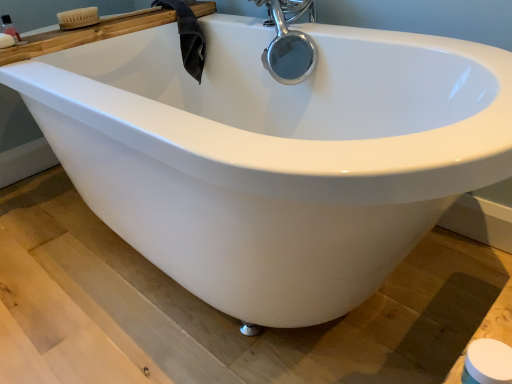
Question: Is white matte soap at upper left bigger than woodenbrush at upper left?

Choices:
 (A) no
 (B) yes

Answer: (A)

Question: Is white matte soap at upper left oriented towards woodenbrush at upper left?

Choices:
 (A) no
 (B) yes

Answer: (A)

Question: Considering the relative positions of white matte soap at upper left and woodenbrush at upper left in the image provided, is white matte soap at upper left to the right of woodenbrush at upper left from the viewer's perspective?

Choices:
 (A) no
 (B) yes

Answer: (A)

Question: Can you confirm if white matte soap at upper left is shorter than woodenbrush at upper left?

Choices:
 (A) no
 (B) yes

Answer: (B)

Question: Does white matte soap at upper left have a smaller size compared to woodenbrush at upper left?

Choices:
 (A) yes
 (B) no

Answer: (A)

Question: Is white matte soap at upper left surrounding woodenbrush at upper left?

Choices:
 (A) no
 (B) yes

Answer: (A)

Question: Does white matte toilet paper at lower right have a larger size compared to woodenbrush at upper left?

Choices:
 (A) yes
 (B) no

Answer: (B)

Question: Can you confirm if white matte toilet paper at lower right is positioned to the left of woodenbrush at upper left?

Choices:
 (A) yes
 (B) no

Answer: (B)

Question: Is white matte toilet paper at lower right further to the viewer compared to woodenbrush at upper left?

Choices:
 (A) no
 (B) yes

Answer: (A)

Question: Considering the relative sizes of white matte toilet paper at lower right and woodenbrush at upper left in the image provided, is white matte toilet paper at lower right thinner than woodenbrush at upper left?

Choices:
 (A) yes
 (B) no

Answer: (A)

Question: Does white matte toilet paper at lower right appear on the right side of woodenbrush at upper left?

Choices:
 (A) no
 (B) yes

Answer: (B)

Question: Could woodenbrush at upper left be considered to be inside white matte toilet paper at lower right?

Choices:
 (A) yes
 (B) no

Answer: (B)

Question: From the image's perspective, is translucent plastic bottle at upper left above white matte toilet paper at lower right?

Choices:
 (A) no
 (B) yes

Answer: (B)